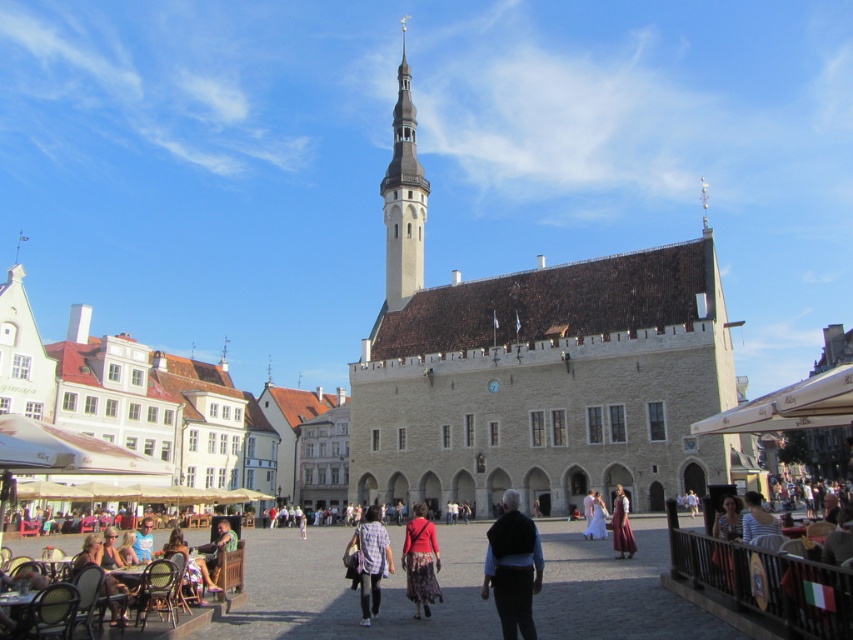
You are a tailor observing two garments in a busy town square scene. You need to determine which garment is taller. The garments are the dark blue fabric vest at center and the matte red sweater at center. Based on the scene, which one is taller?

The dark blue fabric vest at center is taller than the matte red sweater at center.

You are standing in the historic town square and see both the matte black dress at center and the white satin dress at center. If you want to visit both dresses, which one should you approach first to minimize the total distance you walk?

You should approach either dress first since both are at the same central location, so the total distance walked will be the same regardless of the order.

You are standing in the town square and want to approach both the dark blue fabric vest at center and the matte red sweater at center. Which one should you move toward first to reach the one closer to you?

You should move toward the dark blue fabric vest at center first because it is closer to you than the matte red sweater at center.